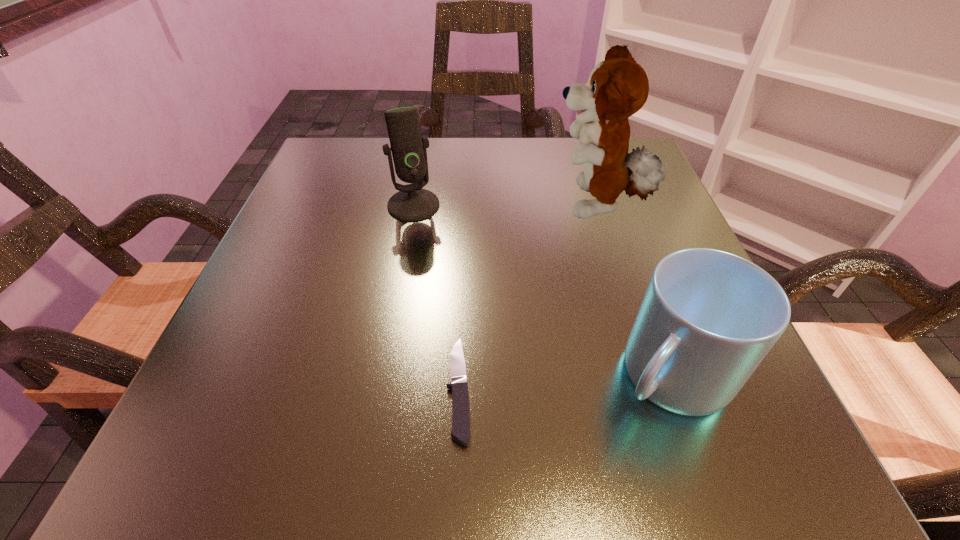
Find the location of a particular element. vacant region located on the left of the third tallest object is located at coordinates (361, 375).

Image resolution: width=960 pixels, height=540 pixels. I want to click on vacant space located on the back of the shortest object, so click(467, 190).

The height and width of the screenshot is (540, 960). Find the location of `puppy present at the far edge`. puppy present at the far edge is located at coordinates (618, 87).

Locate an element on the screen. microphone at the far edge is located at coordinates (412, 203).

Where is `mug situated at the near edge`? This screenshot has height=540, width=960. mug situated at the near edge is located at coordinates (708, 318).

I want to click on steak knife that is at the near edge, so 460,402.

Locate an element on the screen. The image size is (960, 540). puppy at the right edge is located at coordinates (618, 87).

Find the location of a particular element. mug that is at the right edge is located at coordinates (708, 318).

The image size is (960, 540). In order to click on object that is at the far right corner in this screenshot , I will do `click(618, 87)`.

Identify the location of object present at the near right corner. (708, 318).